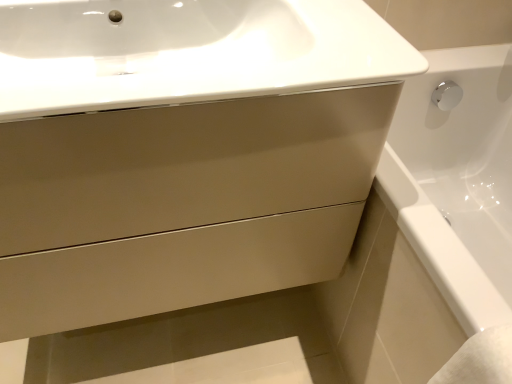
Question: Is matte beige drawer at center bigger or smaller than white glossy sink at upper center?

Choices:
 (A) small
 (B) big

Answer: (B)

Question: Is matte beige drawer at center to the left or to the right of white glossy sink at upper center in the image?

Choices:
 (A) left
 (B) right

Answer: (A)

Question: From a real-world perspective, relative to white glossy sink at upper center, is matte beige drawer at center vertically above or below?

Choices:
 (A) above
 (B) below

Answer: (B)

Question: In the image, is white glossy sink at upper center on the left side or the right side of matte beige drawer at center?

Choices:
 (A) left
 (B) right

Answer: (B)

Question: Is point (29, 104) closer or farther from the camera than point (80, 218)?

Choices:
 (A) farther
 (B) closer

Answer: (B)

Question: From a real-world perspective, is white glossy sink at upper center above or below matte beige drawer at center?

Choices:
 (A) above
 (B) below

Answer: (A)

Question: From the image's perspective, is white glossy sink at upper center located above or below matte beige drawer at center?

Choices:
 (A) below
 (B) above

Answer: (B)